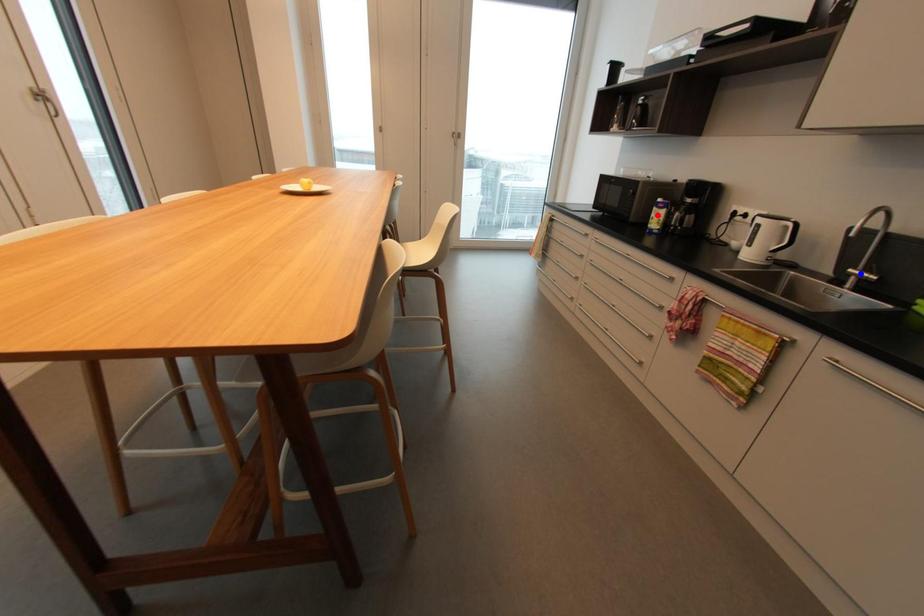
Question: Which of the two points in the image is closer to the camera?

Choices:
 (A) Blue point is closer.
 (B) Red point is closer.

Answer: (A)